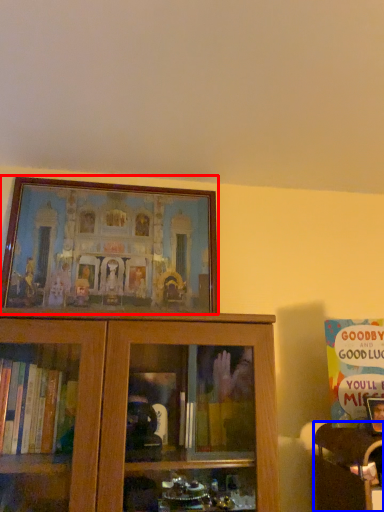
Question: Which point is closer to the camera, picture frame (highlighted by a red box) or furniture (highlighted by a blue box)?

Choices:
 (A) picture frame
 (B) furniture

Answer: (B)